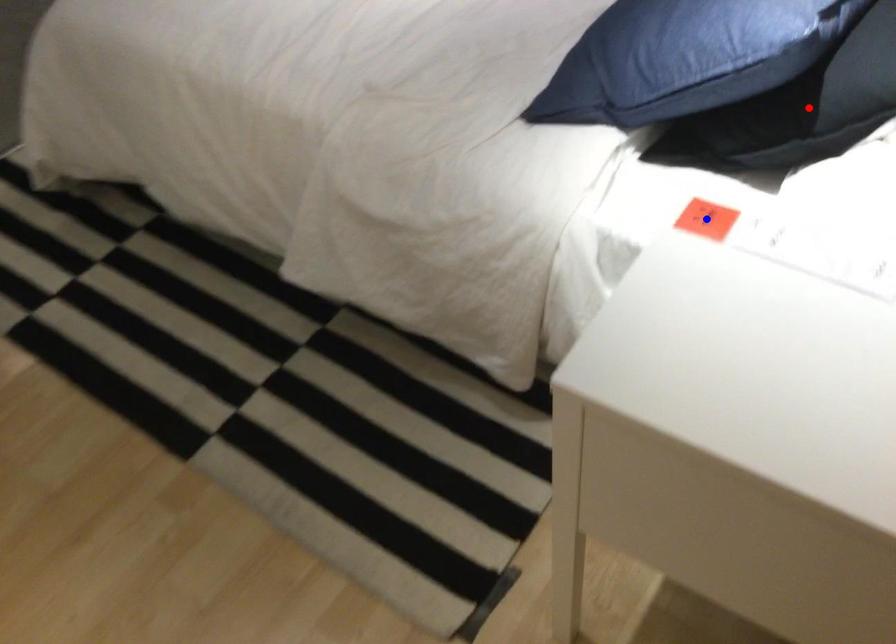
Question: Two points are marked on the image. Which point is closer to the camera?

Choices:
 (A) Blue point is closer.
 (B) Red point is closer.

Answer: (A)